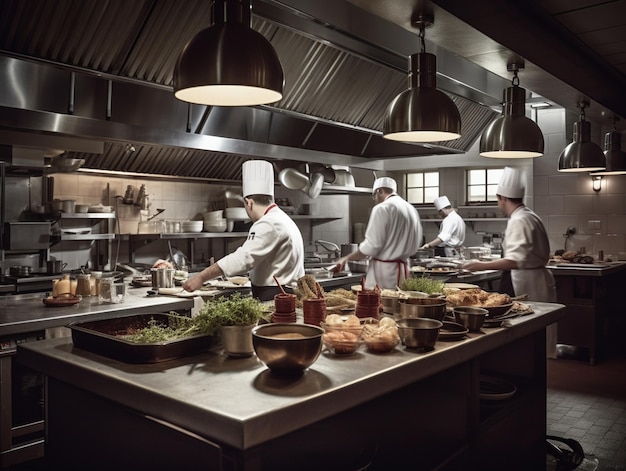
This screenshot has height=471, width=626. I want to click on table top, so click(223, 388).